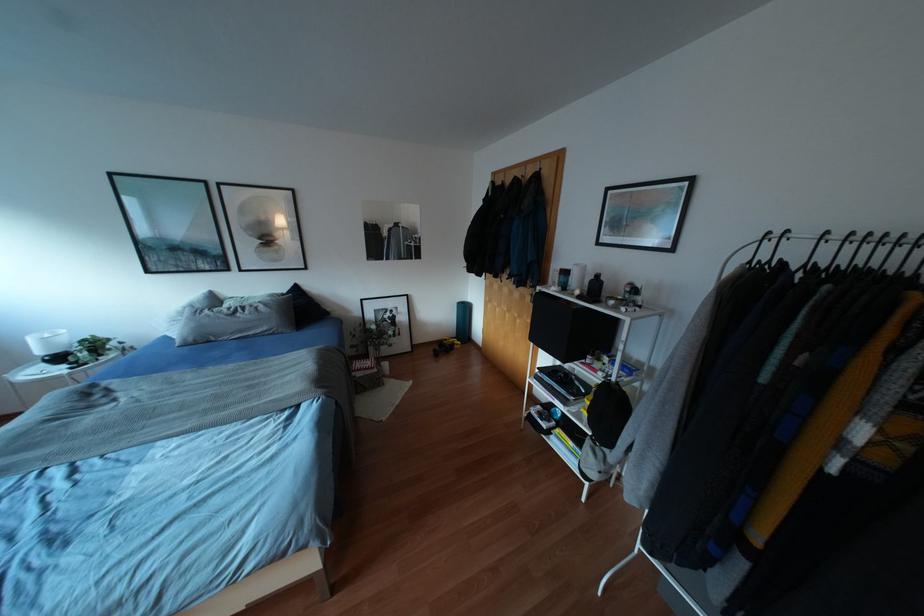
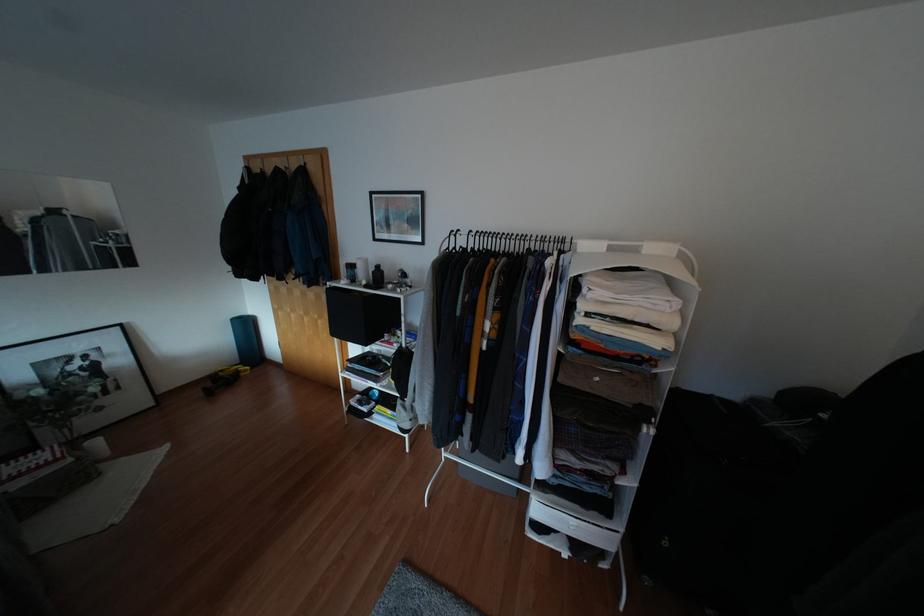
In the second image, find the point that corresponds to (597,276) in the first image.

(377, 265)